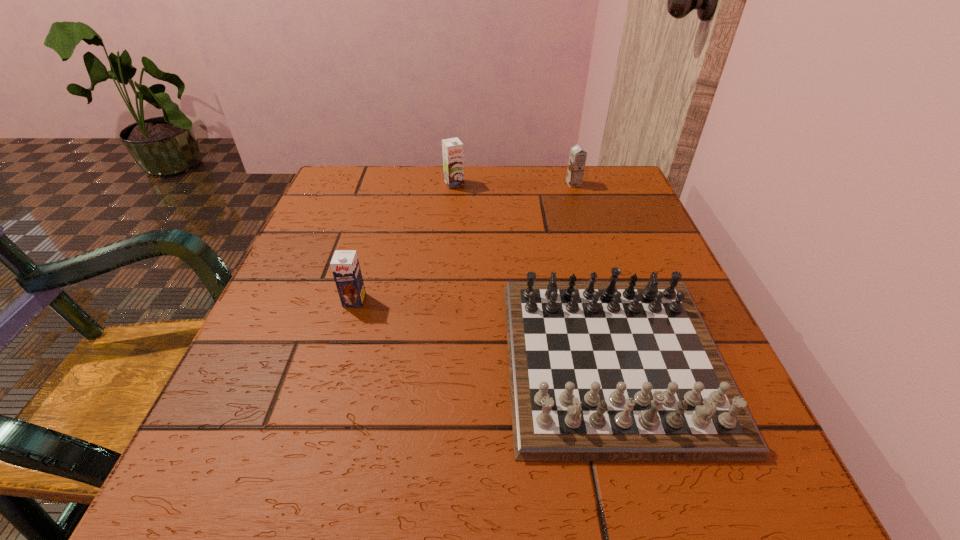
Identify the location of the second object from left to right. The width and height of the screenshot is (960, 540). (453, 162).

Locate an element on the screen. The image size is (960, 540). the nearest chocolate milk is located at coordinates (345, 266).

Find the location of a particular element. the leftmost chocolate milk is located at coordinates (345, 266).

This screenshot has width=960, height=540. In order to click on the rightmost chocolate milk in this screenshot , I will do `click(577, 160)`.

You are a GUI agent. You are given a task and a screenshot of the screen. Output one action in this format:
    pyautogui.click(x=<x>, y=<y>)
    Task: Click on the chessboard
    
    Given the screenshot: What is the action you would take?
    coord(614,370)

The height and width of the screenshot is (540, 960). Identify the location of vacant space located 0.220m on the left of the third object from right to left. (353, 184).

Image resolution: width=960 pixels, height=540 pixels. What are the coordinates of `vacant region located 0.150m on the front label of the leftmost chocolate milk` in the screenshot? It's located at (330, 380).

Where is `free space located on the front of the rightmost chocolate milk`? free space located on the front of the rightmost chocolate milk is located at coordinates (591, 240).

Where is `object present at the near edge`? This screenshot has width=960, height=540. object present at the near edge is located at coordinates coord(614,370).

You are a GUI agent. You are given a task and a screenshot of the screen. Output one action in this format:
    pyautogui.click(x=<x>, y=<y>)
    Task: Click on the object that is at the left edge
    
    Given the screenshot: What is the action you would take?
    pyautogui.click(x=345, y=266)